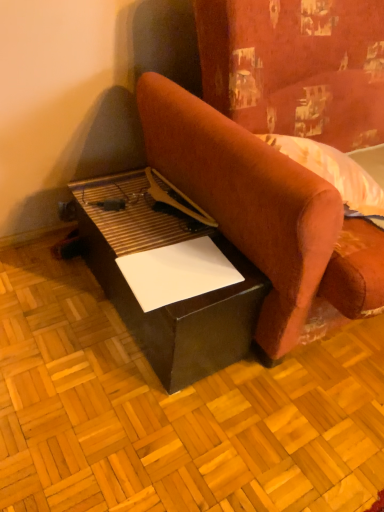
Where is `vacant area on top of white paper at lower center (from a real-world perspective)`? vacant area on top of white paper at lower center (from a real-world perspective) is located at coordinates (180, 268).